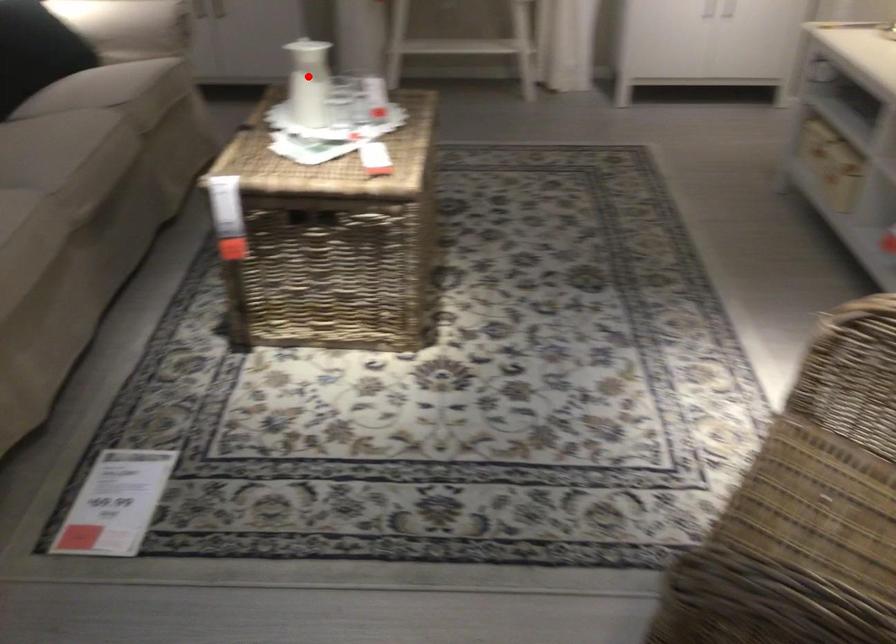
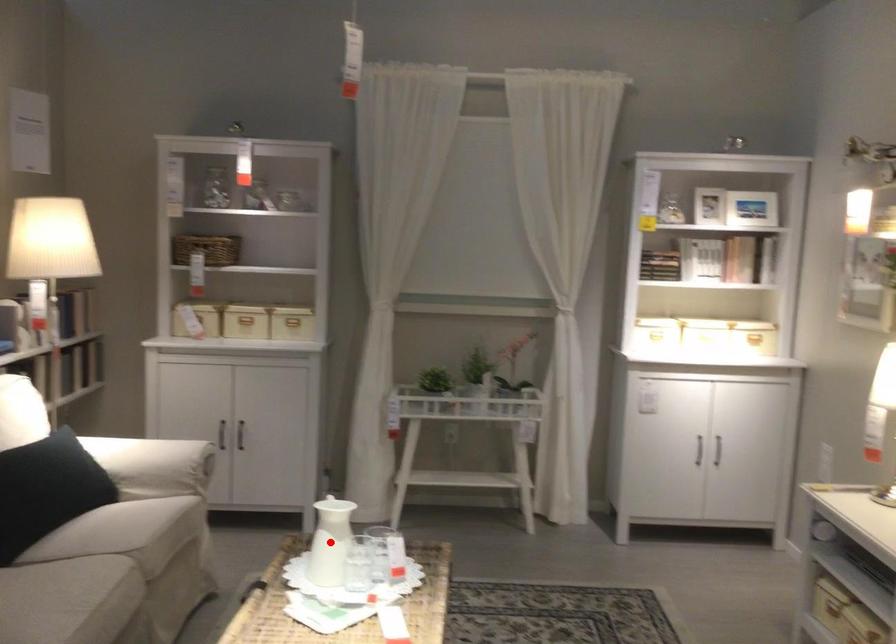
I am providing you with two images of the same scene from different viewpoints. A red point is marked on the first image and another point is marked on the second image. Are the points marked in image1 and image2 representing the same 3D position?

Yes